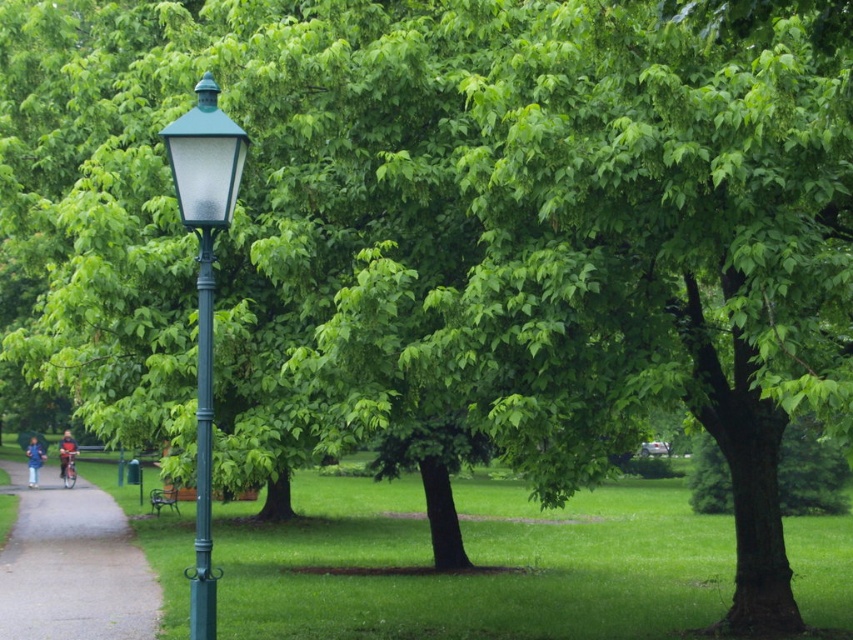
You are a photographer trying to capture the blue denim jacket at lower left and the blue fabric umbrella at lower left in a single frame. Which object should you focus on to ensure both are in the same shot without zooming in?

The blue denim jacket at lower left is larger in size compared to the blue fabric umbrella at lower left, so focusing on the blue denim jacket at lower left would allow both objects to fit within the frame without zooming in.

You are a park visitor trying to find a place to sit. You see the gravel path at lower left and the green metal bench at lower left. Which one has a greater width?

The gravel path at lower left has a greater width than the green metal bench at lower left.

You are standing in the park and see two points in the scene. The first point is at coordinates point (207, 232) and the second point is at point (61, 465). Which point is closer to you?

Point (207, 232) is closer to the viewer than point (61, 465).